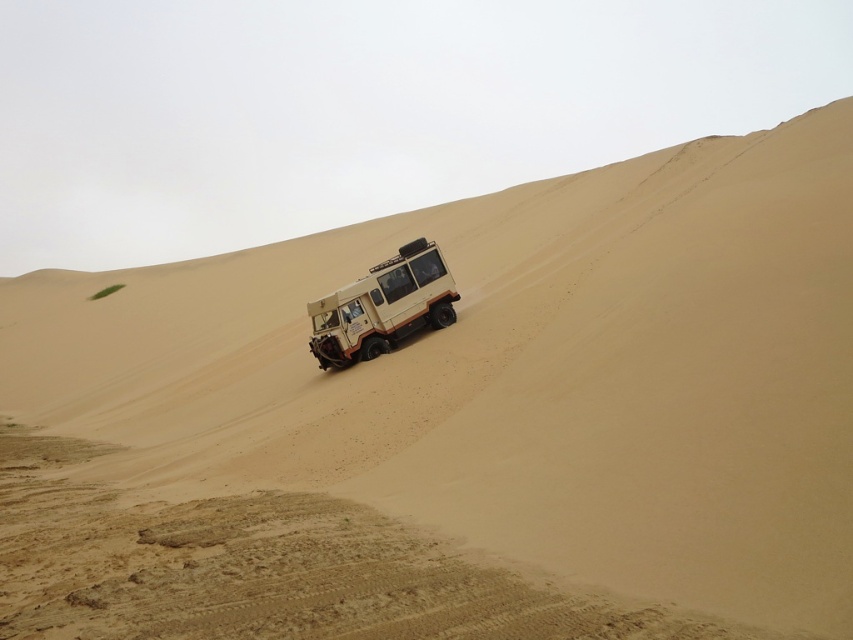
Who is taller, brown sandy dirt track at lower center or beige matte jeep at center?

beige matte jeep at center is taller.

Between point (297, 616) and point (364, 321), which one is positioned in front?

Point (297, 616)

Who is more distant from viewer, [364,576] or [347,362]?

The point [347,362] is more distant.

Locate an element on the screen. This screenshot has width=853, height=640. brown sandy dirt track at lower center is located at coordinates (263, 570).